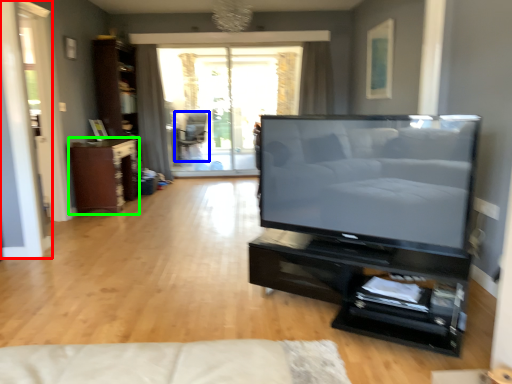
Question: Based on their relative distances, which object is nearer to screen door (highlighted by a red box)? Choose from chair (highlighted by a blue box) and cabinetry (highlighted by a green box).

Choices:
 (A) chair
 (B) cabinetry

Answer: (B)